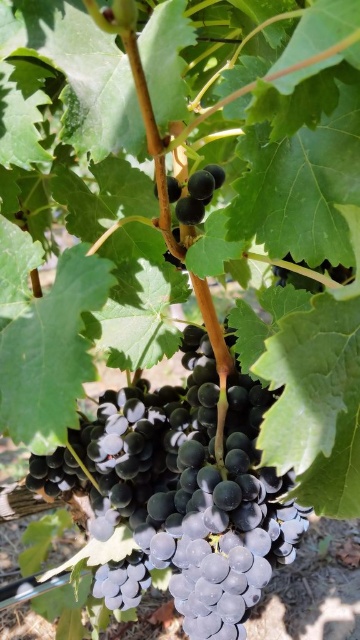
You are a farmer checking the grapevine. You notice a point in the image at coordinates (181, 493). What type of grapes are located at that point?

The grapes located at point (181, 493) are shiny purple grapes at center.

You are a fruit picker holding a basket. You see the shiny purple grapes at center and the shiny dark purple grape at center. Which one is closer to your basket?

The shiny dark purple grape at center is closer to your basket since it is only 20.07 inches away from the shiny purple grapes at center.